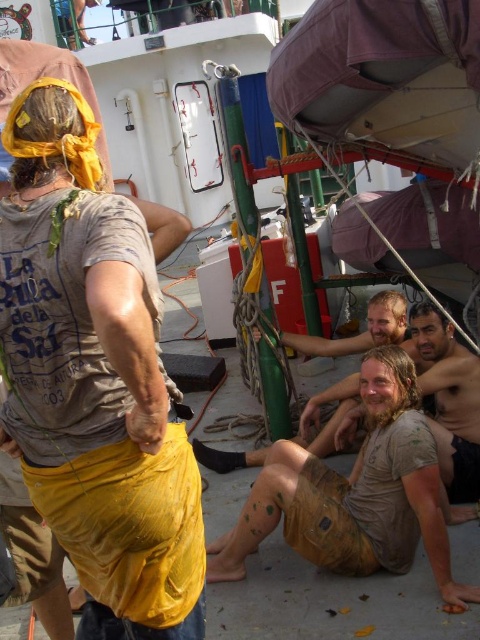
You are a sailor on the ship and need to cover a large crate with fabric. The crate is wider than the dirty beige shorts at lower right. Can the yellow fabric at center cover the crate?

The yellow fabric at center has a width larger than the dirty beige shorts at lower right. Since the crate is wider than the dirty beige shorts at lower right, the yellow fabric at center should be able to cover the crate as its width is sufficient.

You are a photographer trying to capture both the brown textured shorts at lower center and the dirty beige shorts at lower right in a single frame. Given their sizes, which pair of shorts will you need to position closer to the camera to ensure they appear similar in size in the photo?

The brown textured shorts at lower center is larger in size than the dirty beige shorts at lower right, so to make them appear similar in size in the photo, you should position the dirty beige shorts at lower right closer to the camera than the brown textured shorts at lower center.

You are standing on the deck of the boat and see the yellow fabric at center. If you want to reach it without moving your feet, is it within arm reach?

The yellow fabric at center is 2.02 meters away from the viewer. Since the average human arm span is about 1.5 meters, the yellow fabric at center is beyond arm reach.